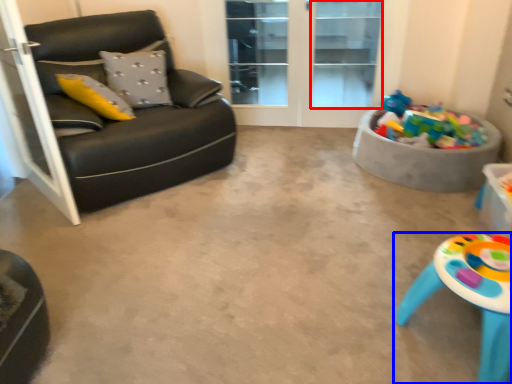
Question: Which object appears closest to the camera in this image, window (highlighted by a red box) or table (highlighted by a blue box)?

Choices:
 (A) window
 (B) table

Answer: (B)